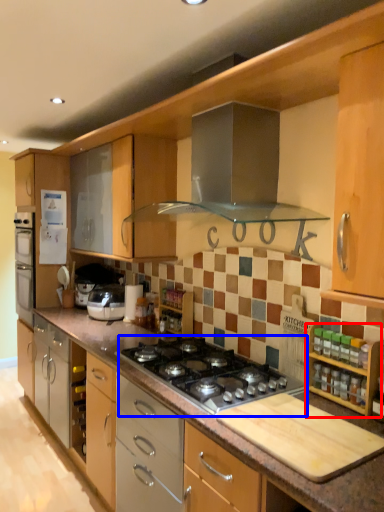
Question: Which point is closer to the camera, cabinetry (highlighted by a red box) or gas stove (highlighted by a blue box)?

Choices:
 (A) cabinetry
 (B) gas stove

Answer: (A)